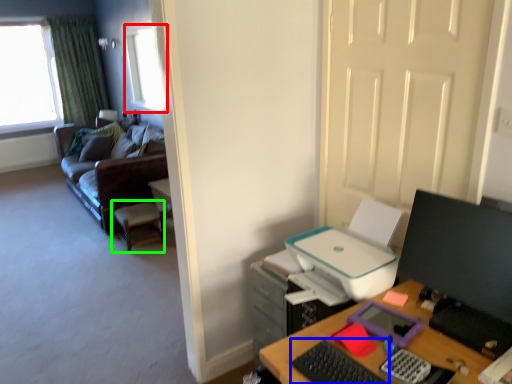
Question: Estimate the real-world distances between objects in this image. Which object is closer to window (highlighted by a red box), keyboard (highlighted by a blue box) or computer chair (highlighted by a green box)?

Choices:
 (A) keyboard
 (B) computer chair

Answer: (B)